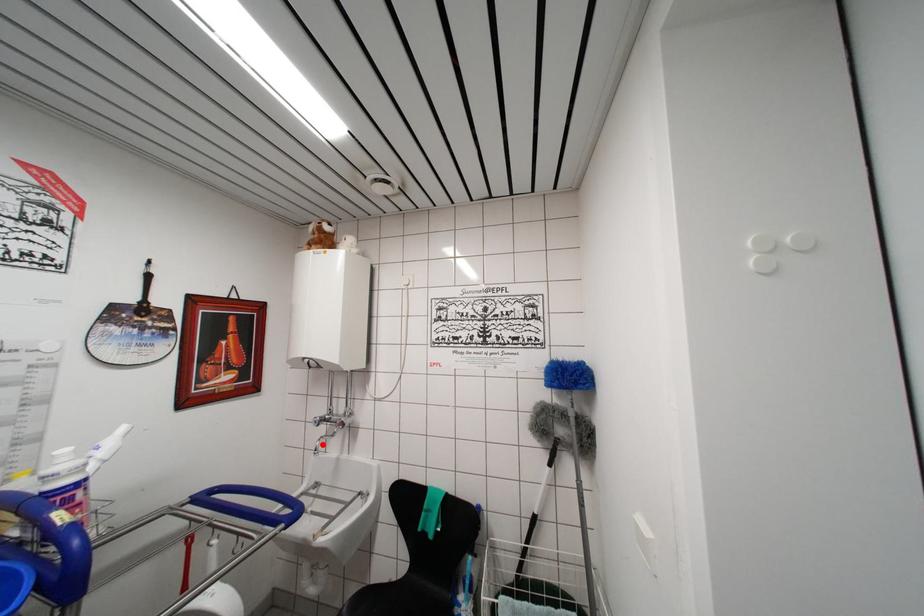
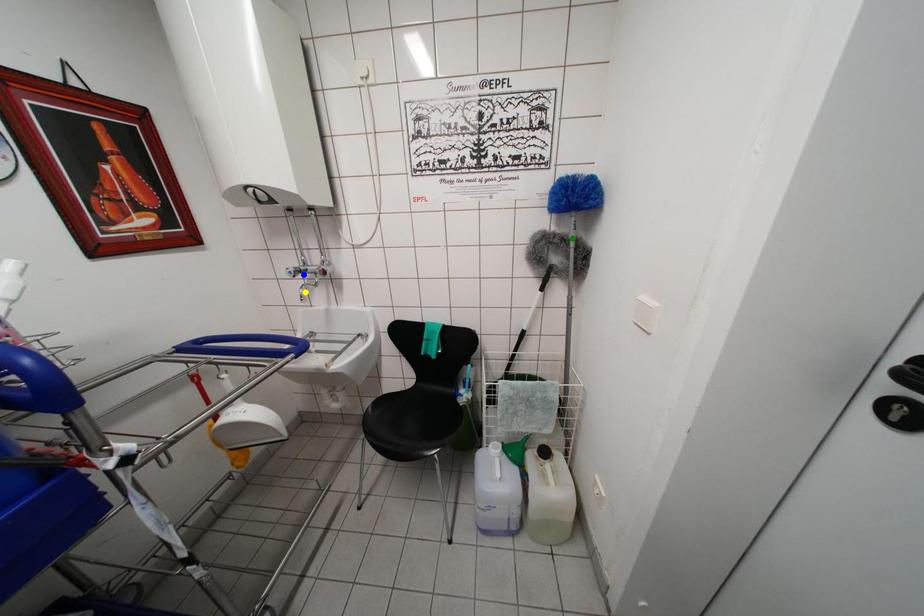
Question: I am providing you with two images of the same scene from different viewpoints. A red point is marked on the first image. You are given multiple points on the second image. In image 2, which mark is for the same physical point as the one in image 1?

Choices:
 (A) green point
 (B) blue point
 (C) yellow point

Answer: (C)